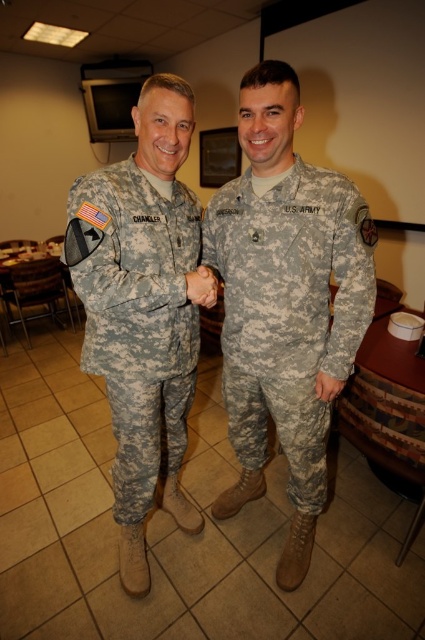
Question: Which point is closer to the camera?

Choices:
 (A) camouflage fabric uniform at left
 (B) camouflage fabric uniform at center

Answer: (A)

Question: Estimate the real-world distances between objects in this image. Which object is closer to the matte camouflage hand at center?

Choices:
 (A) camouflage fabric uniform at left
 (B) camouflage uniform at center
 (C) camouflage fabric uniform at center

Answer: (A)

Question: Can you confirm if camouflage uniform at center is wider than matte camouflage hand at center?

Choices:
 (A) no
 (B) yes

Answer: (B)

Question: Does camouflage fabric uniform at center have a lesser width compared to matte camouflage hand at center?

Choices:
 (A) no
 (B) yes

Answer: (A)

Question: Estimate the real-world distances between objects in this image. Which object is closer to the camouflage fabric uniform at center?

Choices:
 (A) matte camouflage hand at center
 (B) camouflage uniform at center

Answer: (B)

Question: Does camouflage uniform at center have a lesser width compared to camouflage fabric uniform at left?

Choices:
 (A) no
 (B) yes

Answer: (A)